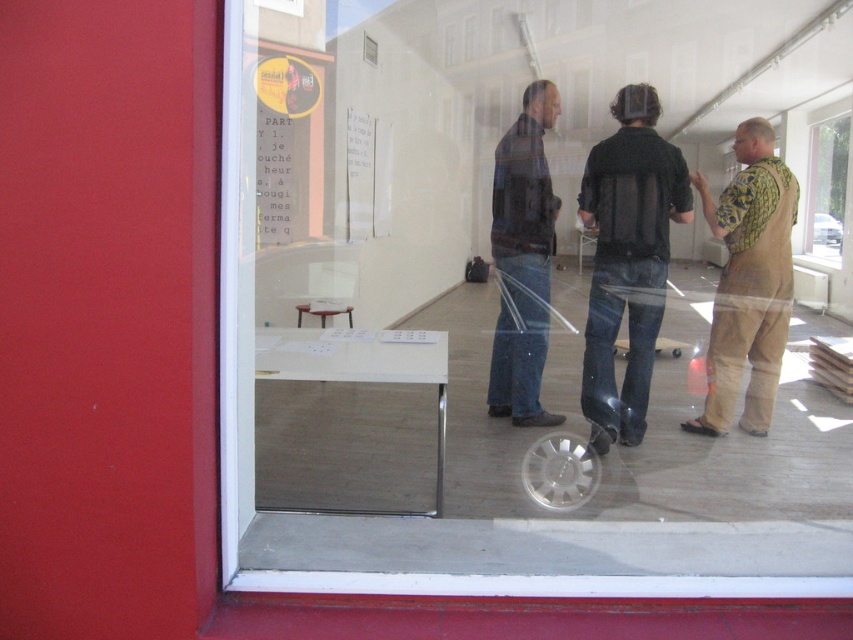
Question: Is dark blue jeans at center thinner than transparent glass window at upper right?

Choices:
 (A) yes
 (B) no

Answer: (A)

Question: Can you confirm if transparent glass at center is positioned below black matte vest at center?

Choices:
 (A) no
 (B) yes

Answer: (A)

Question: Among these objects, which one is farthest from the camera?

Choices:
 (A) dark blue jeans at center
 (B) black matte vest at center

Answer: (A)

Question: Which point is farther from the camera taking this photo?

Choices:
 (A) (519, 348)
 (B) (744, 228)
 (C) (540, 566)
 (D) (589, 412)

Answer: (A)

Question: Does black matte vest at center lie in front of camouflage shirt at right?

Choices:
 (A) yes
 (B) no

Answer: (A)

Question: Which of the following is the farthest from the observer?

Choices:
 (A) transparent glass at center
 (B) black matte vest at center
 (C) transparent glass window at upper right

Answer: (C)